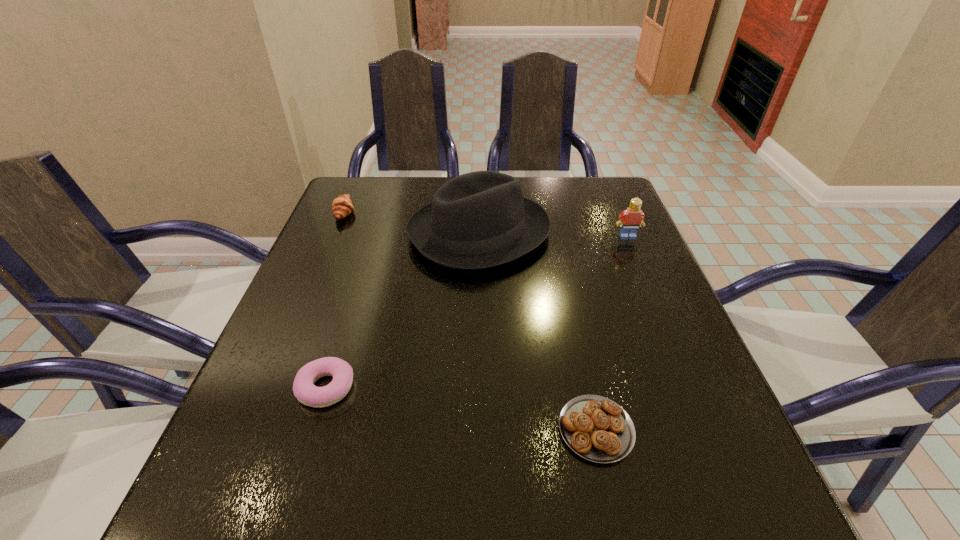
Locate an element on the screen. This screenshot has width=960, height=540. fedora is located at coordinates tap(477, 220).

Where is `the second tallest object`? The height and width of the screenshot is (540, 960). the second tallest object is located at coordinates (630, 219).

Find the location of `Lego`. Lego is located at coordinates (630, 219).

Where is `the third shortest object`? the third shortest object is located at coordinates (342, 206).

This screenshot has height=540, width=960. Identify the location of the farthest pastry. (342, 206).

I want to click on the second pastry from left to right, so click(304, 390).

You are a GUI agent. You are given a task and a screenshot of the screen. Output one action in this format:
    pyautogui.click(x=<x>, y=<y>)
    Task: Click on the rightmost pastry
    The image size is (960, 540).
    Given the screenshot: What is the action you would take?
    pyautogui.click(x=596, y=428)

Find the location of a particular element. The height and width of the screenshot is (540, 960). vacant space located 0.180m on the left of the tallest object is located at coordinates (336, 233).

Where is `free region located 0.100m on the front-facing side of the fourth shortest object`? The image size is (960, 540). free region located 0.100m on the front-facing side of the fourth shortest object is located at coordinates (639, 266).

You are a GUI agent. You are given a task and a screenshot of the screen. Output one action in this format:
    pyautogui.click(x=<x>, y=<y>)
    Task: Click on the free location located 0.330m on the front-facing side of the tallest pastry
    The width and height of the screenshot is (960, 540).
    Given the screenshot: What is the action you would take?
    pyautogui.click(x=478, y=212)